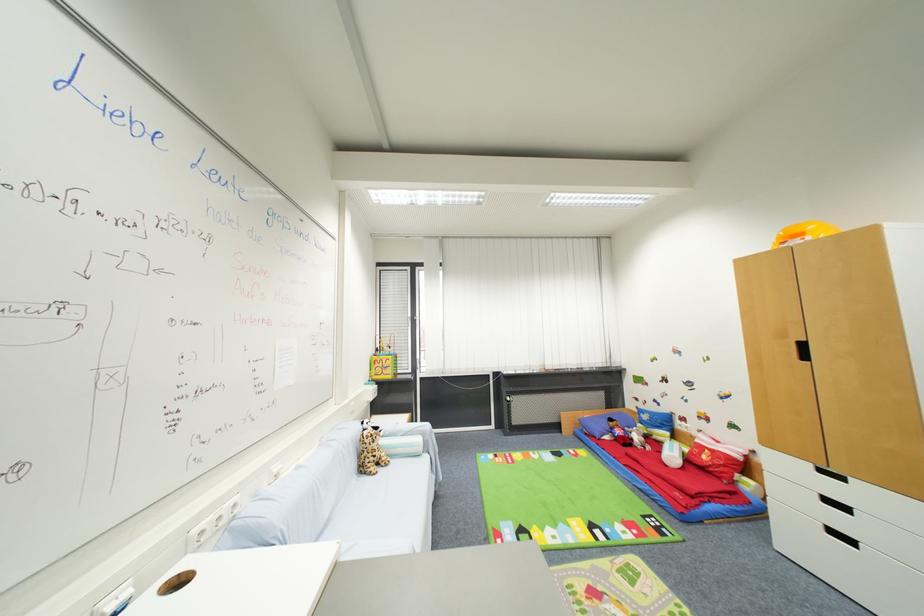
Which object does [803,233] point to?

It corresponds to the yellow toy helmet in the image.